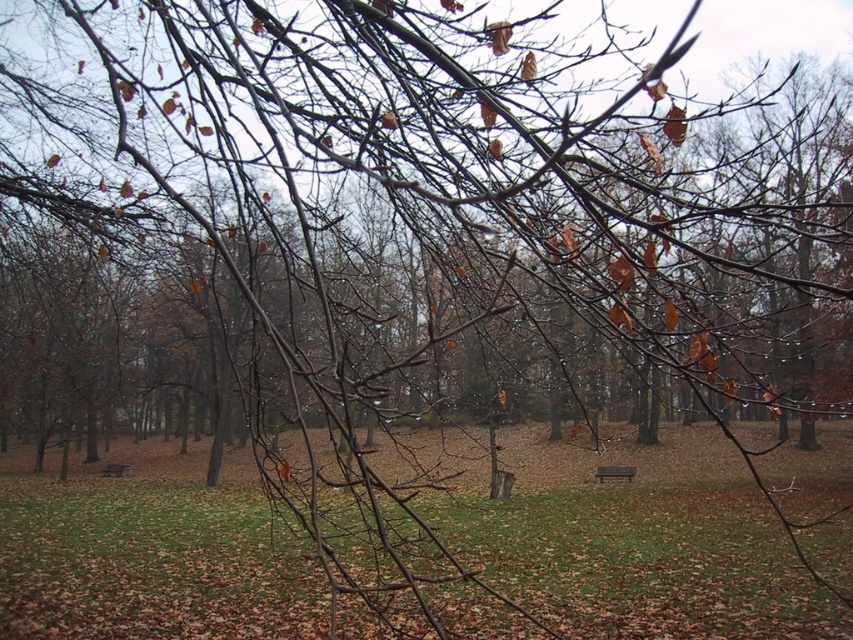
From the picture: Which is more to the left, brown wooden bench at center or wooden bench at center?

wooden bench at center

Can you confirm if brown wooden bench at center is positioned to the left of wooden bench at center?

Incorrect, brown wooden bench at center is not on the left side of wooden bench at center.

Who is more forward, (633, 474) or (131, 474)?

Positioned in front is point (633, 474).

This screenshot has height=640, width=853. What are the coordinates of `brown wooden bench at center` in the screenshot? It's located at (614, 472).